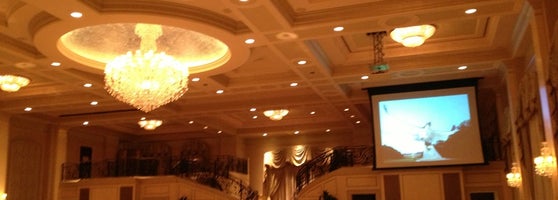
The width and height of the screenshot is (558, 200). Find the location of `light`. light is located at coordinates (411, 33).